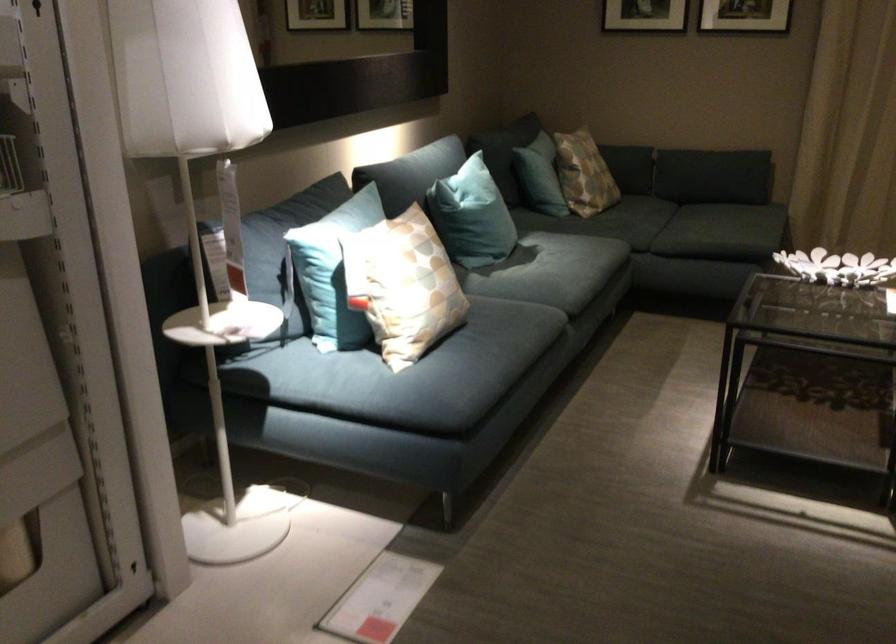
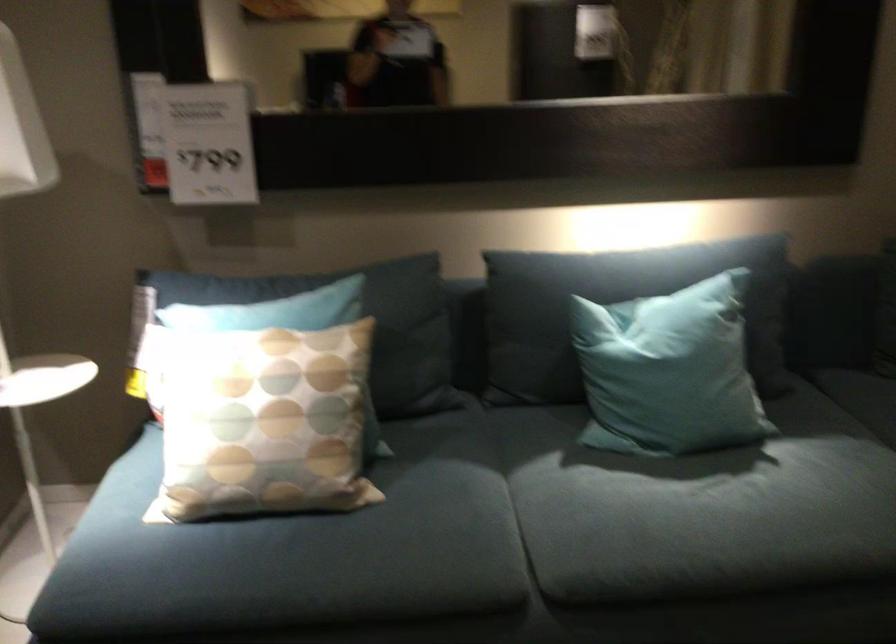
Where in the second image is the point corresponding to (x=431, y=277) from the first image?

(263, 422)